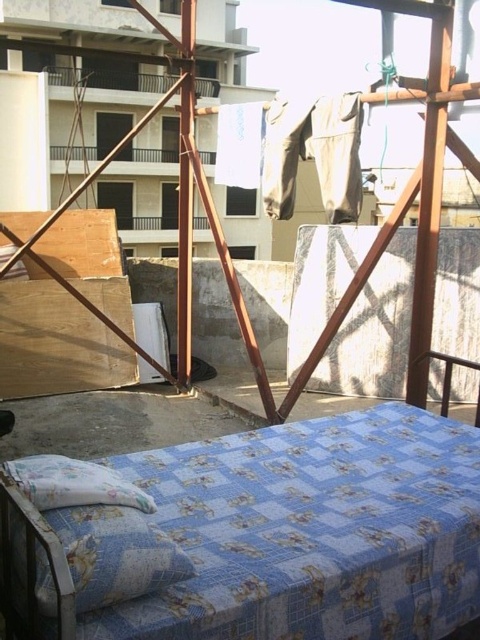
You are standing on the rooftop and want to place a new small plant pot exactly at the center of the rooftop. The blue printed fabric bed at center is located at coordinate point 0.900, 0.067. What coordinate should you aim for to place the plant pot at the true center of the rooftop?

The true center of the rooftop would be at coordinate point (x=240, y=320). Since the blue printed fabric bed at center is at (x=32, y=576), you should aim for the coordinate point (x=240, y=320) to place the plant pot at the true center of the rooftop.

You are standing at the point with coordinates point [32,576]. Looking around, you see the blue printed fabric bed at center. Based on your current position, which direction should you move to reach the bed?

You are already at the blue printed fabric bed at center, as the point [32,576] corresponds to it.